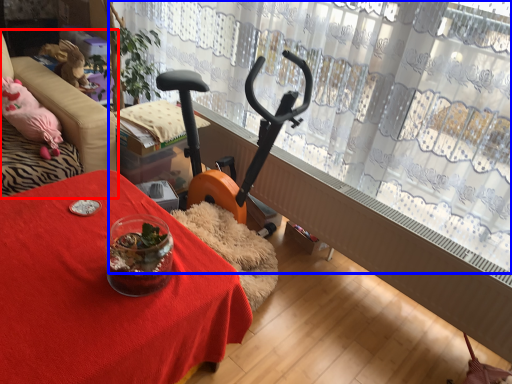
Question: Which object appears closest to the camera in this image, furniture (highlighted by a red box) or curtain (highlighted by a blue box)?

Choices:
 (A) furniture
 (B) curtain

Answer: (B)